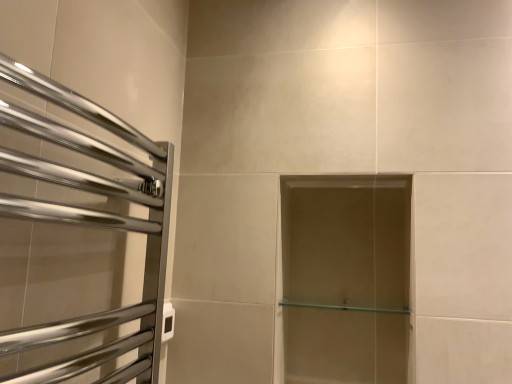
What do you see at coordinates (344, 307) in the screenshot?
I see `clear glass shelf at center` at bounding box center [344, 307].

The height and width of the screenshot is (384, 512). What are the coordinates of `clear glass shelf at center` in the screenshot? It's located at (344, 307).

Find the location of a particular element. polished chrome towel rack at left is located at coordinates (88, 224).

The width and height of the screenshot is (512, 384). What do you see at coordinates (88, 224) in the screenshot?
I see `polished chrome towel rack at left` at bounding box center [88, 224].

What is the approximate width of polished chrome towel rack at left?

polished chrome towel rack at left is 11.22 centimeters wide.

The image size is (512, 384). What are the coordinates of `clear glass shelf at center` in the screenshot? It's located at (344, 307).

Does polished chrome towel rack at left appear on the right side of clear glass shelf at center?

Incorrect, polished chrome towel rack at left is not on the right side of clear glass shelf at center.

Who is more distant, polished chrome towel rack at left or clear glass shelf at center?

clear glass shelf at center is further from the camera.

Which is behind, point (119, 162) or point (378, 308)?

The point (378, 308) is farther.

From the image's perspective, which one is positioned higher, polished chrome towel rack at left or clear glass shelf at center?

polished chrome towel rack at left appears higher in the image.

From a real-world perspective, is polished chrome towel rack at left on clear glass shelf at center?

Indeed, from a real-world perspective, polished chrome towel rack at left stands above clear glass shelf at center.

Which object is thinner, polished chrome towel rack at left or clear glass shelf at center?

polished chrome towel rack at left.

Can you confirm if polished chrome towel rack at left is shorter than clear glass shelf at center?

Incorrect, the height of polished chrome towel rack at left does not fall short of that of clear glass shelf at center.

Does polished chrome towel rack at left have a smaller size compared to clear glass shelf at center?

Actually, polished chrome towel rack at left might be larger than clear glass shelf at center.

Can we say polished chrome towel rack at left lies outside clear glass shelf at center?

Absolutely, polished chrome towel rack at left is external to clear glass shelf at center.

Is there a large distance between polished chrome towel rack at left and clear glass shelf at center?

No.

Is polished chrome towel rack at left aimed at clear glass shelf at center?

No, polished chrome towel rack at left is not aimed at clear glass shelf at center.

Identify the location of shelf behind the polished chrome towel rack at left. The image size is (512, 384). (344, 307).

Between clear glass shelf at center and polished chrome towel rack at left, which one appears on the left side from the viewer's perspective?

polished chrome towel rack at left is more to the left.

Considering their positions, is clear glass shelf at center located in front of or behind polished chrome towel rack at left?

clear glass shelf at center is positioned farther from the viewer than polished chrome towel rack at left.

Considering the points (356, 310) and (6, 215), which point is behind, point (356, 310) or point (6, 215)?

Point (356, 310)

From the image's perspective, would you say clear glass shelf at center is shown under polished chrome towel rack at left?

Yes, from the image's perspective, clear glass shelf at center is beneath polished chrome towel rack at left.

From a real-world perspective, is clear glass shelf at center positioned above or below polished chrome towel rack at left?

Clearly, from a real-world perspective, clear glass shelf at center is below polished chrome towel rack at left.

From the picture: Looking at their sizes, would you say clear glass shelf at center is wider or thinner than polished chrome towel rack at left?

In the image, clear glass shelf at center appears to be wider than polished chrome towel rack at left.

In the scene shown: Between clear glass shelf at center and polished chrome towel rack at left, which one has more height?

With more height is polished chrome towel rack at left.

Consider the image. Which of these two, clear glass shelf at center or polished chrome towel rack at left, is smaller?

clear glass shelf at center is smaller.

Is clear glass shelf at center spatially inside polished chrome towel rack at left, or outside of it?

clear glass shelf at center cannot be found inside polished chrome towel rack at left.

Is clear glass shelf at center placed right next to polished chrome towel rack at left?

There is a gap between clear glass shelf at center and polished chrome towel rack at left.

Is clear glass shelf at center oriented away from polished chrome towel rack at left?

No, clear glass shelf at center is not facing away from polished chrome towel rack at left.

What's the angular difference between clear glass shelf at center and polished chrome towel rack at left's facing directions?

The angle between the facing direction of clear glass shelf at center and the facing direction of polished chrome towel rack at left is 90.1 degrees.

This screenshot has height=384, width=512. I want to click on shelf below the polished chrome towel rack at left (from the image's perspective), so click(344, 307).

Identify the location of shelf on the right of polished chrome towel rack at left. The height and width of the screenshot is (384, 512). (344, 307).

This screenshot has width=512, height=384. Find the location of `screen door above the clear glass shelf at center (from a real-world perspective)`. screen door above the clear glass shelf at center (from a real-world perspective) is located at coordinates (88, 224).